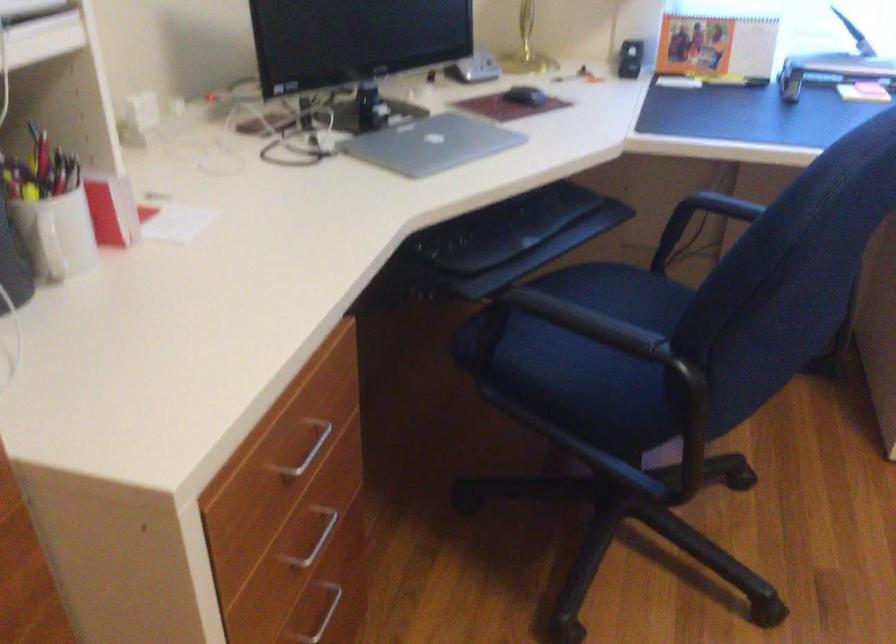
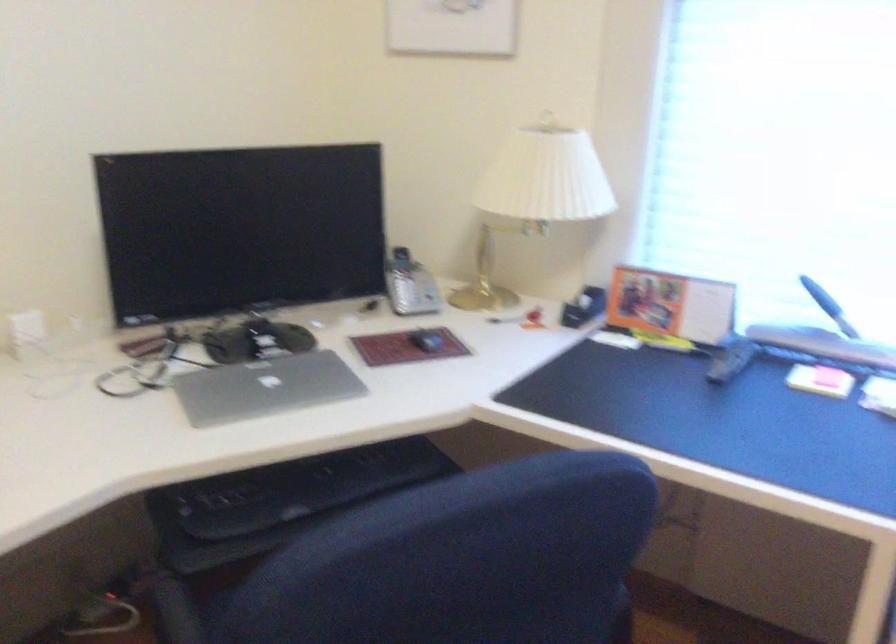
Question: The camera is either moving clockwise (left) or counter-clockwise (right) around the object. The first image is from the beginning of the video and the second image is from the end. Is the camera moving left or right when shooting the video?

Choices:
 (A) Left
 (B) Right

Answer: (B)